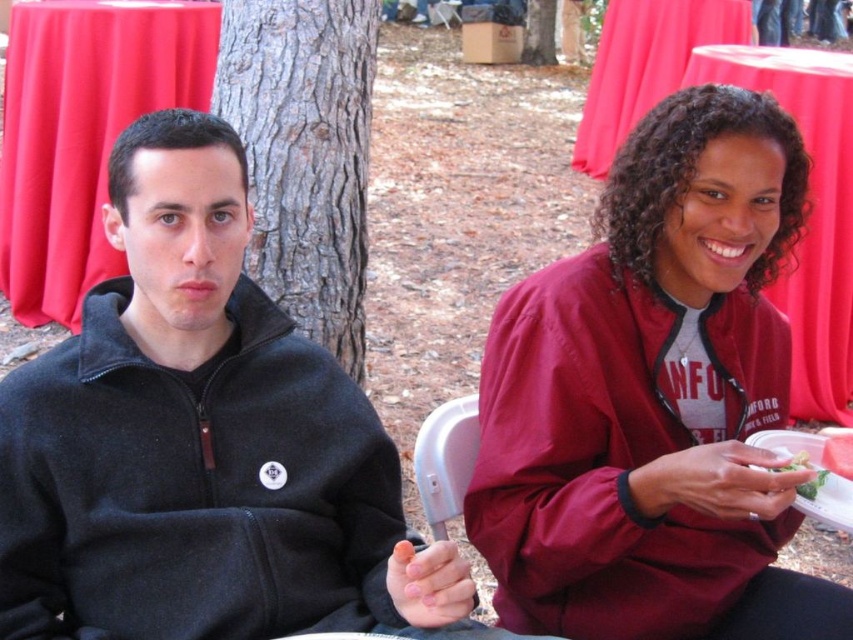
Who is shorter, brown rough bark at center or green leafy salad at lower right?

With less height is green leafy salad at lower right.

From the picture: Which is below, brown rough bark at center or green leafy salad at lower right?

green leafy salad at lower right is below.

Find the location of a particular element. The width and height of the screenshot is (853, 640). brown rough bark at center is located at coordinates (305, 154).

Does burgundy fabric jacket at center have a lesser width compared to red cloth table at upper center?

Yes, burgundy fabric jacket at center is thinner than red cloth table at upper center.

Measure the distance between burgundy fabric jacket at center and red cloth table at upper center.

A distance of 6.95 feet exists between burgundy fabric jacket at center and red cloth table at upper center.

Locate an element on the screen. burgundy fabric jacket at center is located at coordinates (654, 397).

Does red cloth table at left lie behind green leafy salad at lower right?

Yes, it is.

The height and width of the screenshot is (640, 853). What are the coordinates of `red cloth table at left` in the screenshot? It's located at (83, 131).

Find the location of a particular element. red cloth table at left is located at coordinates (83, 131).